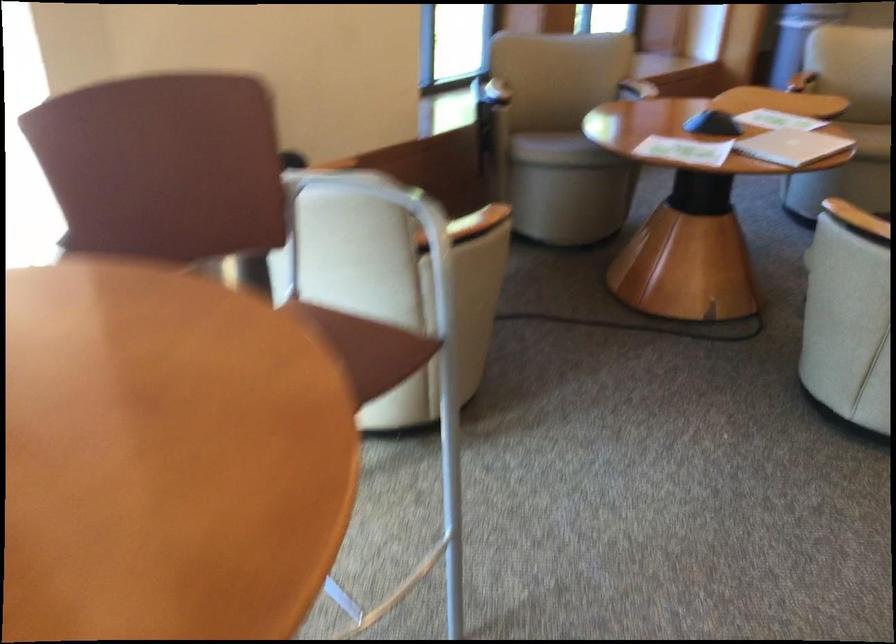
Identify the location of beige chair sitting surface. This screenshot has height=644, width=896. (561, 149).